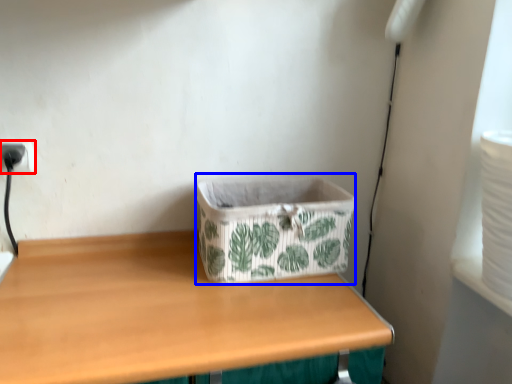
Question: Which object is closer to the camera taking this photo, electric outlet (highlighted by a red box) or storage box (highlighted by a blue box)?

Choices:
 (A) electric outlet
 (B) storage box

Answer: (B)